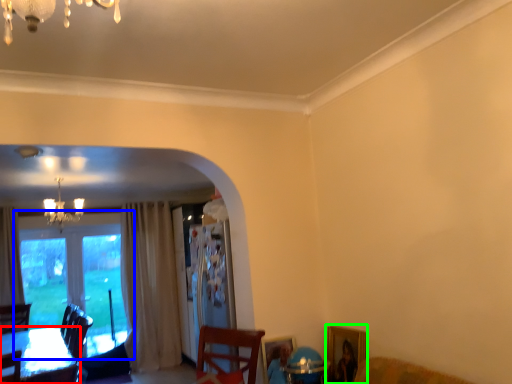
Question: Which is nearer to the table (highlighted by a red box)? window (highlighted by a blue box) or picture frame (highlighted by a green box).

Choices:
 (A) window
 (B) picture frame

Answer: (A)